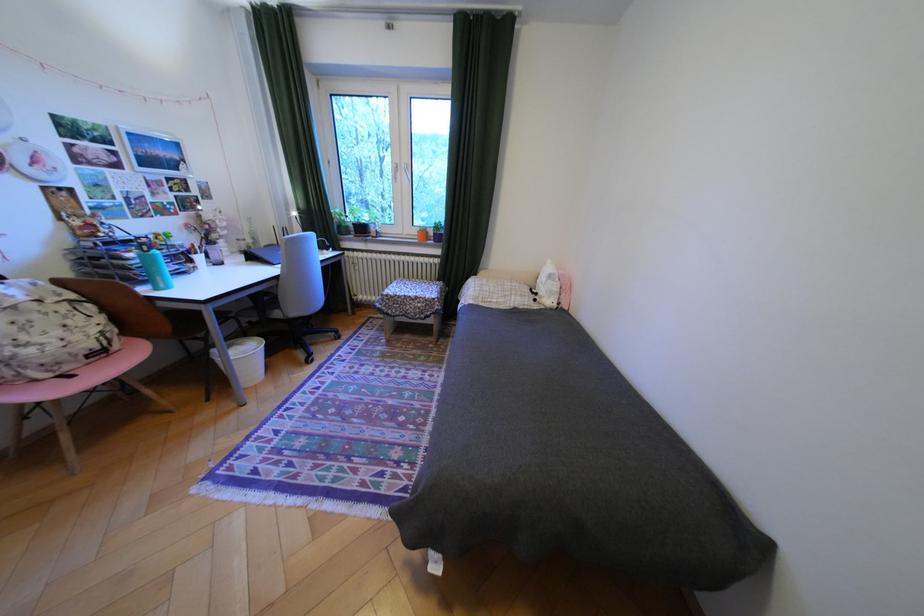
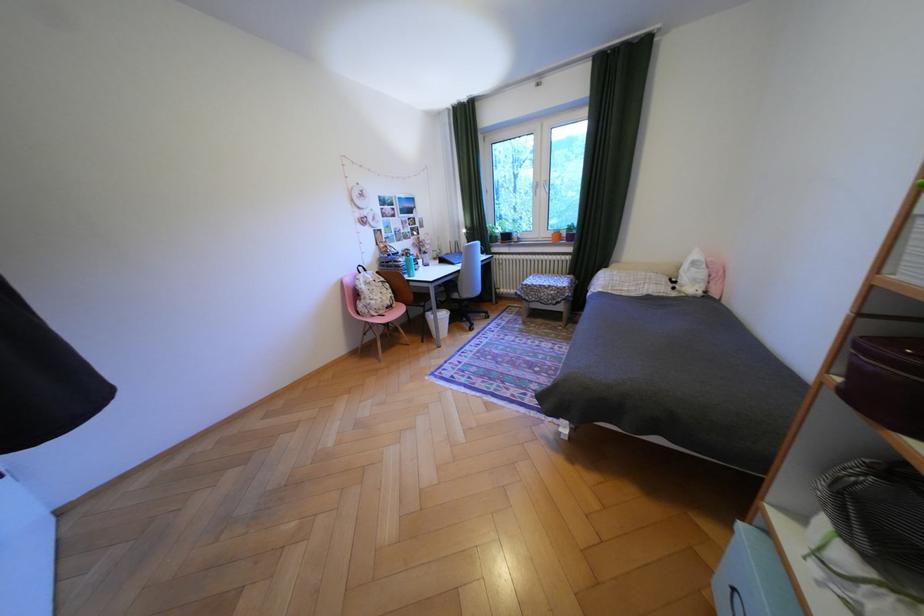
Find the pixel in the second image that matches (140,254) in the first image.

(411, 259)